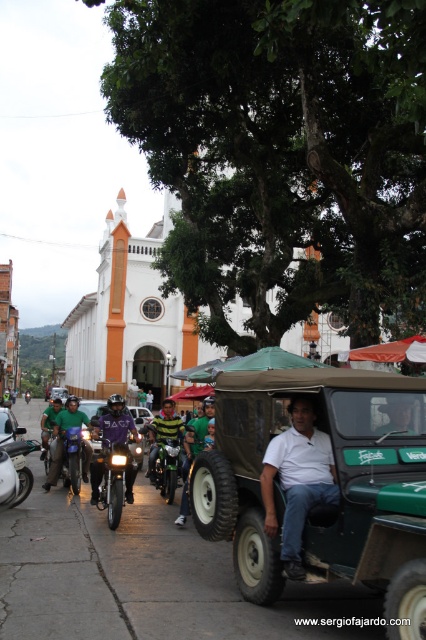
Question: Does green matte jeep at center have a larger size compared to shiny blue motorcycle at center?

Choices:
 (A) no
 (B) yes

Answer: (B)

Question: Which object is positioned closest to the metallic silver car at center?

Choices:
 (A) green matte motorcycle at left
 (B) green matte jeep at center
 (C) shiny chrome motorcycle at center

Answer: (C)

Question: Is metallic silver car at center to the right of green matte motorcycle at left from the viewer's perspective?

Choices:
 (A) yes
 (B) no

Answer: (A)

Question: Which is farther from the green matte jeep at center?

Choices:
 (A) metallic silver car at left
 (B) shiny chrome motorcycle at center

Answer: (A)

Question: Is shiny chrome motorcycle at center further to camera compared to shiny blue motorcycle at center?

Choices:
 (A) no
 (B) yes

Answer: (A)

Question: Among these points, which one is farthest from the camera?

Choices:
 (A) pyautogui.click(x=293, y=429)
 (B) pyautogui.click(x=311, y=516)
 (C) pyautogui.click(x=77, y=476)
 (D) pyautogui.click(x=65, y=388)

Answer: (D)